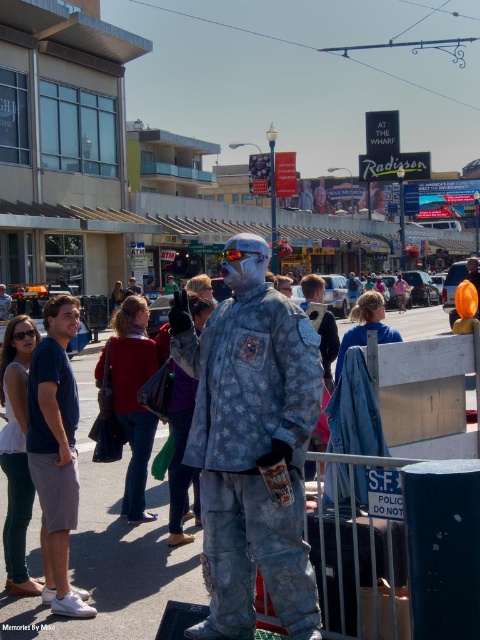
You are a photographer trying to capture a photo of both the metallic silver statue at center and the blue denim shorts at left. Based on their positions, which object should you focus on first to ensure both are in the frame?

The metallic silver statue at center is positioned on the right side of blue denim shorts at left, so you should focus on the blue denim shorts at left first to ensure both are in the frame.

You are a city planner reviewing this area for accessibility improvements. You notice the metallic silver statue at center and the camouflage fabric mannequin at center. Which object is positioned higher in the scene?

The metallic silver statue at center is located above the camouflage fabric mannequin at center, so it is positioned higher in the scene.